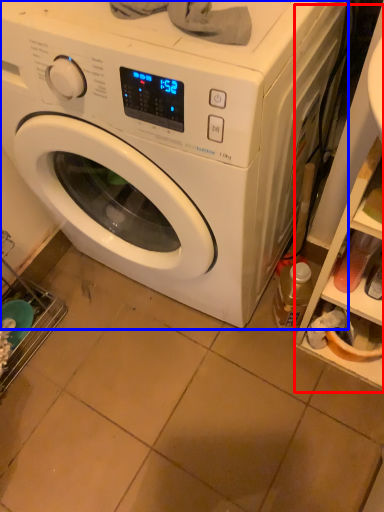
Question: Which object appears farthest to the camera in this image, shelf (highlighted by a red box) or washing machine (highlighted by a blue box)?

Choices:
 (A) shelf
 (B) washing machine

Answer: (A)